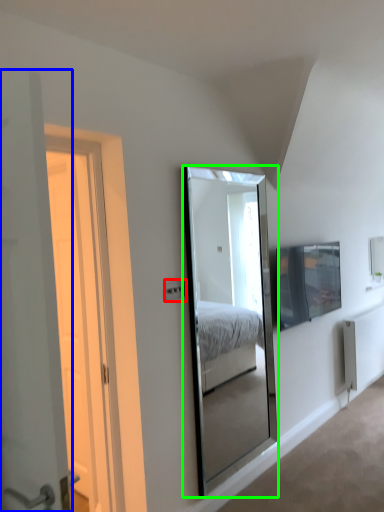
Question: Considering the real-world distances, which object is closest to electric outlet (highlighted by a red box)? door (highlighted by a blue box) or mirror (highlighted by a green box).

Choices:
 (A) door
 (B) mirror

Answer: (A)